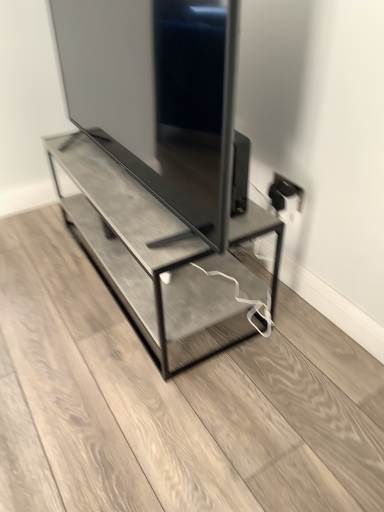
What is the approximate height of white plastic electric outlet at upper right?

3.94 inches.

What is the approximate width of white plastic electric outlet at upper right?

The width of white plastic electric outlet at upper right is 0.50 inches.

Describe the element at coordinates (284, 193) in the screenshot. The height and width of the screenshot is (512, 384). I see `white plastic electric outlet at upper right` at that location.

Measure the distance between point (281, 194) and camera.

They are 1.22 meters apart.

Where is `white plastic electric outlet at upper right`? The width and height of the screenshot is (384, 512). white plastic electric outlet at upper right is located at coordinates (284, 193).

This screenshot has height=512, width=384. Identify the location of white plastic electric outlet at upper right. (284, 193).